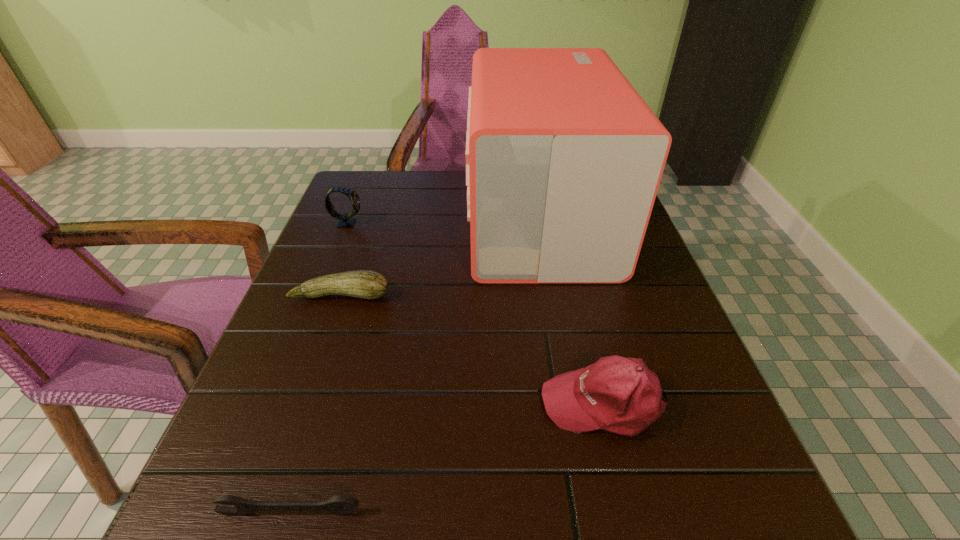
You are a GUI agent. You are given a task and a screenshot of the screen. Output one action in this format:
    pyautogui.click(x=<x>, y=<y>)
    Task: Click on the blank space located 0.190m on the face of the watch
    
    Given the screenshot: What is the action you would take?
    pyautogui.click(x=439, y=223)

This screenshot has width=960, height=540. Find the location of `vacant area situated 0.050m at the front of the fourth farthest object with the brim`. vacant area situated 0.050m at the front of the fourth farthest object with the brim is located at coordinates [x=511, y=403].

Where is `vacant space located at the front of the fourth farthest object with the brim`? The height and width of the screenshot is (540, 960). vacant space located at the front of the fourth farthest object with the brim is located at coordinates (363, 403).

Where is `vacant space positioned at the front of the fourth farthest object with the brim`? vacant space positioned at the front of the fourth farthest object with the brim is located at coordinates (296, 403).

This screenshot has height=540, width=960. What are the coordinates of `free space located 0.130m at the stem end of the fourth tallest object` in the screenshot? It's located at (320, 356).

Image resolution: width=960 pixels, height=540 pixels. I want to click on object present at the far edge, so click(x=564, y=158).

Locate an element on the screen. This screenshot has width=960, height=540. object positioned at the near edge is located at coordinates (339, 505).

Identify the location of watch that is at the left edge. This screenshot has height=540, width=960. (345, 221).

Locate an element on the screen. Image resolution: width=960 pixels, height=540 pixels. zucchini located in the left edge section of the desktop is located at coordinates (365, 284).

You are a GUI agent. You are given a task and a screenshot of the screen. Output one action in this format:
    pyautogui.click(x=<x>, y=<y>)
    Task: Click on the wrench present at the left edge
    
    Given the screenshot: What is the action you would take?
    pyautogui.click(x=339, y=505)